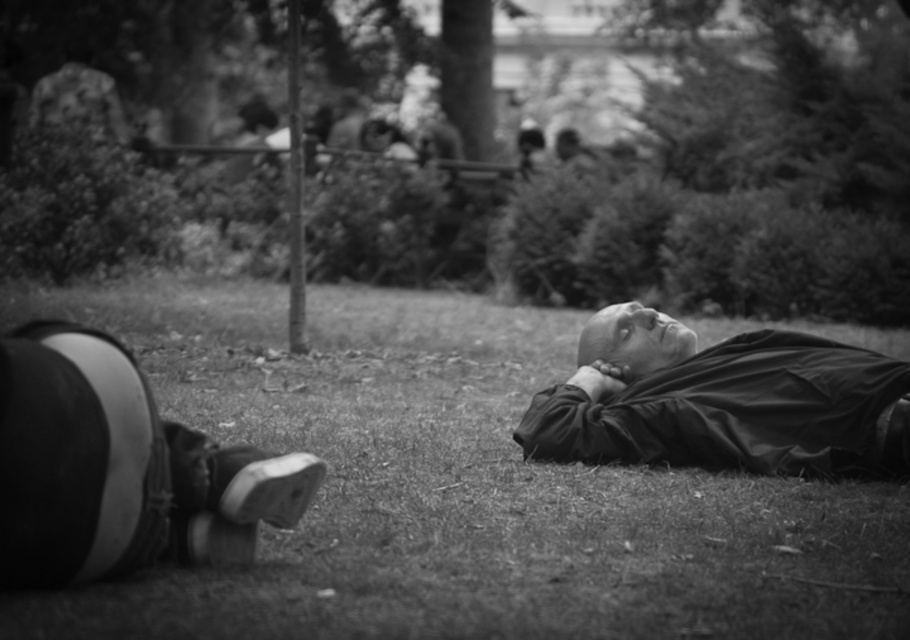
Looking at this image, you are a delivery robot with a package that needs to be placed between the grassy lawn at center and the smooth black jacket at center. The package is 1.5 meters long. Will it fit in the space between them?

The distance between the grassy lawn at center and the smooth black jacket at center is 1.33 meters. Since the package is 1.5 meters long, it will not fit in the space between them as it exceeds the available distance.

You are a photographer adjusting your camera to focus on the grassy lawn at center and the smooth black jacket at center. Which object should you focus on first to ensure both are in focus?

You should focus on the grassy lawn at center first since it is closer to the viewer than the smooth black jacket at center, allowing the jacket to fall into focus as you adjust the depth of field.